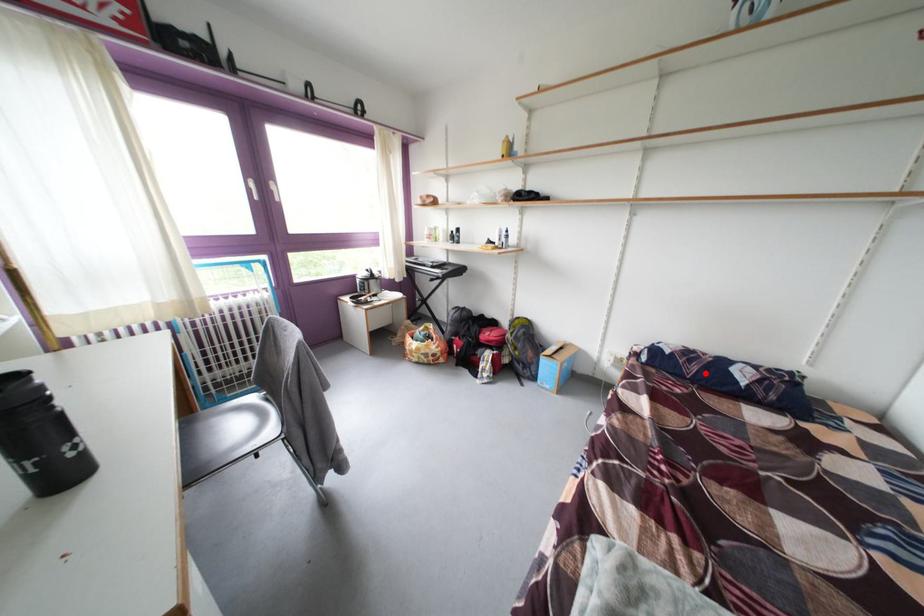
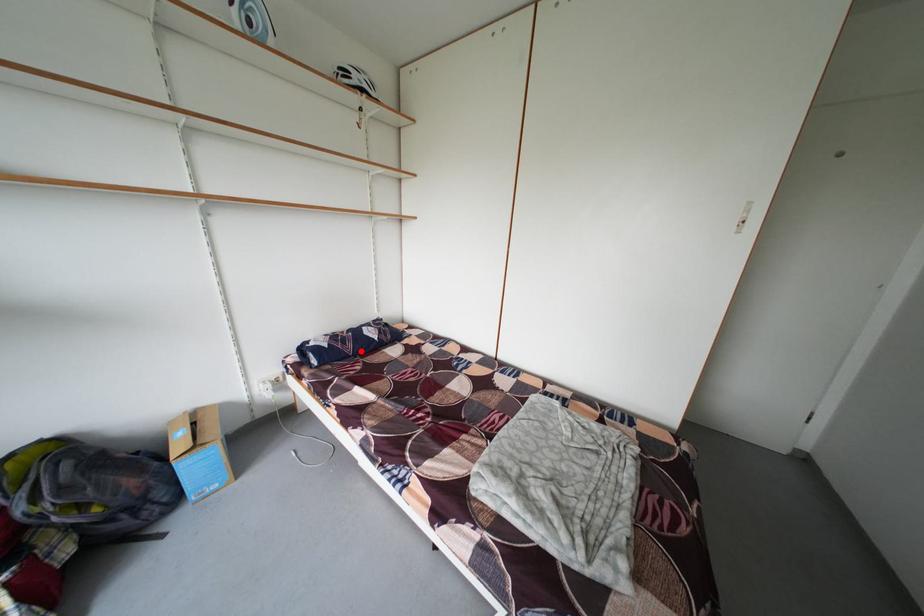
I am providing you with two images of the same scene from different viewpoints. A red point is marked on the first image and another point is marked on the second image. Are the points marked in image1 and image2 representing the same 3D position?

Yes